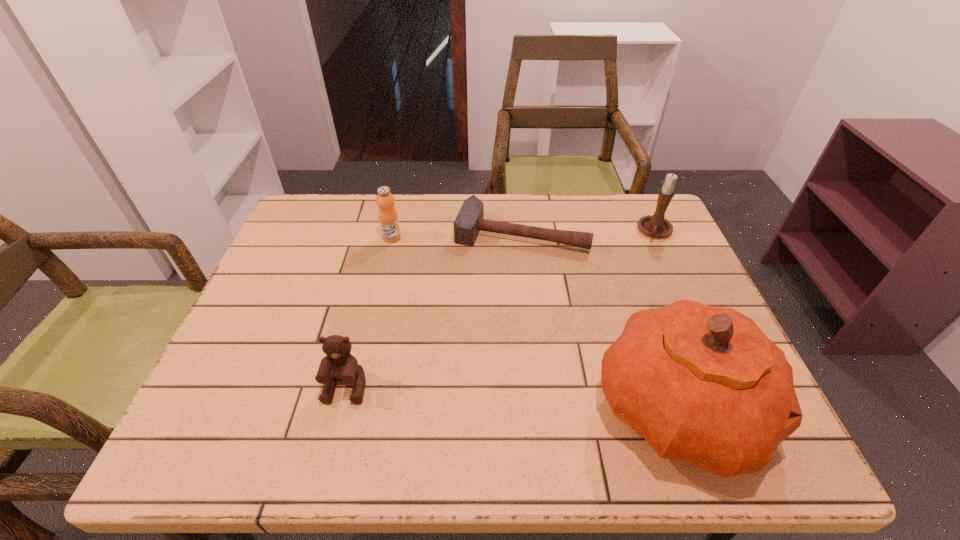
Locate an element on the screen. The image size is (960, 540). vacant spot on the desktop that is between the fourth tallest object and the tallest object and is positioned on the side of the candle holder with the handle is located at coordinates (553, 400).

Find the location of `free space on the desktop that is between the teddy bear and the tallest object and is positioned on the front label of the third shortest object`. free space on the desktop that is between the teddy bear and the tallest object and is positioned on the front label of the third shortest object is located at coordinates (539, 399).

You are a GUI agent. You are given a task and a screenshot of the screen. Output one action in this format:
    pyautogui.click(x=<x>, y=<y>)
    Task: Click on the vacant spot on the desktop that is between the fourth tallest object and the tallest object and is positioned on the striking surface of the shortest object
    
    Given the screenshot: What is the action you would take?
    pyautogui.click(x=473, y=395)